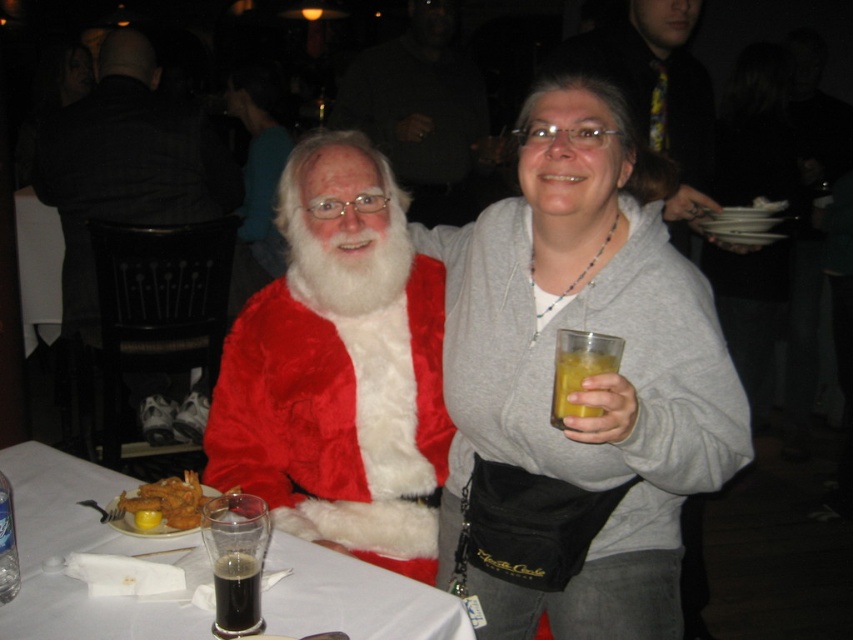
You are a photographer at the event and need to ensure that both the matte gray hoodie at center and the golden fried shrimp at lower left are clearly visible in the photo. Given their sizes, which object might require you to adjust your camera angle to avoid being too small in the frame?

The golden fried shrimp at lower left might require adjusting the camera angle because it is smaller in size compared to the matte gray hoodie at center, so it could appear too small in the frame if not positioned properly.

You are a photographer at the event and need to decide which clothing item to focus on for a closeup. Since the matte gray hoodie at center is thinner than the fuzzy red coat at center, which one would you choose to highlight the texture differences between the two?

The fuzzy red coat at center has a thicker texture compared to the matte gray hoodie at center, so focusing on the fuzzy red coat at center would better highlight the texture differences between the two.